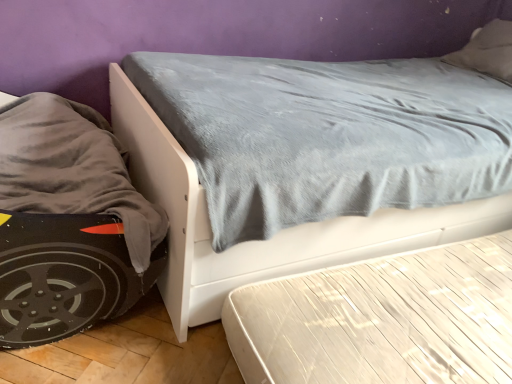
Measure the distance between white glossy mattress at lower right and camera.

white glossy mattress at lower right and camera are 97.92 centimeters apart.

What do you see at coordinates (381, 319) in the screenshot?
I see `white glossy mattress at lower right` at bounding box center [381, 319].

The width and height of the screenshot is (512, 384). Find the location of `white glossy mattress at lower right`. white glossy mattress at lower right is located at coordinates (381, 319).

The width and height of the screenshot is (512, 384). What do you see at coordinates (267, 240) in the screenshot? I see `velvet gray bed at center` at bounding box center [267, 240].

What is the approximate height of velvet gray bed at center?

34.77 inches.

The height and width of the screenshot is (384, 512). I want to click on velvet gray bed at center, so click(267, 240).

The width and height of the screenshot is (512, 384). What are the coordinates of `white glossy mattress at lower right` in the screenshot? It's located at (381, 319).

Which is more to the right, white glossy mattress at lower right or velvet gray bed at center?

white glossy mattress at lower right.

Which is behind, white glossy mattress at lower right or velvet gray bed at center?

white glossy mattress at lower right is further from the camera.

Considering the positions of points (279, 313) and (340, 249), is point (279, 313) closer to camera compared to point (340, 249)?

Yes, it is.

From the image's perspective, which one is positioned lower, white glossy mattress at lower right or velvet gray bed at center?

white glossy mattress at lower right.

From a real-world perspective, is white glossy mattress at lower right positioned under velvet gray bed at center based on gravity?

Yes.

Does white glossy mattress at lower right have a greater width compared to velvet gray bed at center?

Yes, white glossy mattress at lower right is wider than velvet gray bed at center.

Who is taller, white glossy mattress at lower right or velvet gray bed at center?

Standing taller between the two is velvet gray bed at center.

Which of these two, white glossy mattress at lower right or velvet gray bed at center, is bigger?

Bigger between the two is velvet gray bed at center.

Is white glossy mattress at lower right spatially inside velvet gray bed at center, or outside of it?

white glossy mattress at lower right is spatially situated outside velvet gray bed at center.

Is white glossy mattress at lower right not near velvet gray bed at center?

No.

Is white glossy mattress at lower right positioned with its back to velvet gray bed at center?

No, white glossy mattress at lower right's orientation is not away from velvet gray bed at center.

At what (x,y) coordinates should I click in order to perform the action: click on bed in front of the white glossy mattress at lower right. Please return your answer as a coordinate pair (x, y). The height and width of the screenshot is (384, 512). Looking at the image, I should click on (267, 240).

Is velvet gray bed at center at the right side of white glossy mattress at lower right?

In fact, velvet gray bed at center is to the left of white glossy mattress at lower right.

Which object is closer to the camera, velvet gray bed at center or white glossy mattress at lower right?

velvet gray bed at center.

Does point (458, 232) come farther from viewer compared to point (301, 309)?

Yes, it is.

From the image's perspective, is velvet gray bed at center below white glossy mattress at lower right?

No, from the image's perspective, velvet gray bed at center is not below white glossy mattress at lower right.

From a real-world perspective, who is located lower, velvet gray bed at center or white glossy mattress at lower right?

white glossy mattress at lower right, from a real-world perspective.

Considering the sizes of velvet gray bed at center and white glossy mattress at lower right in the image, is velvet gray bed at center wider or thinner than white glossy mattress at lower right?

In the image, velvet gray bed at center appears to be more narrow than white glossy mattress at lower right.

Can you confirm if velvet gray bed at center is shorter than white glossy mattress at lower right?

No, velvet gray bed at center is not shorter than white glossy mattress at lower right.

Between velvet gray bed at center and white glossy mattress at lower right, which one has smaller size?

With smaller size is white glossy mattress at lower right.

Is velvet gray bed at center situated inside white glossy mattress at lower right or outside?

velvet gray bed at center cannot be found inside white glossy mattress at lower right.

Is velvet gray bed at center next to white glossy mattress at lower right and touching it?

No.

Is velvet gray bed at center facing away from white glossy mattress at lower right?

No, velvet gray bed at center's orientation is not away from white glossy mattress at lower right.

You are a GUI agent. You are given a task and a screenshot of the screen. Output one action in this format:
    pyautogui.click(x=<x>, y=<y>)
    Task: Click on the bed frame that is below the velvet gray bed at center (from the image's perspective)
    The height and width of the screenshot is (384, 512).
    Given the screenshot: What is the action you would take?
    pyautogui.click(x=381, y=319)

Locate an element on the screen. This screenshot has width=512, height=384. bed lying in front of the white glossy mattress at lower right is located at coordinates (267, 240).

In order to click on bed frame below the velvet gray bed at center (from the image's perspective) in this screenshot , I will do `click(381, 319)`.